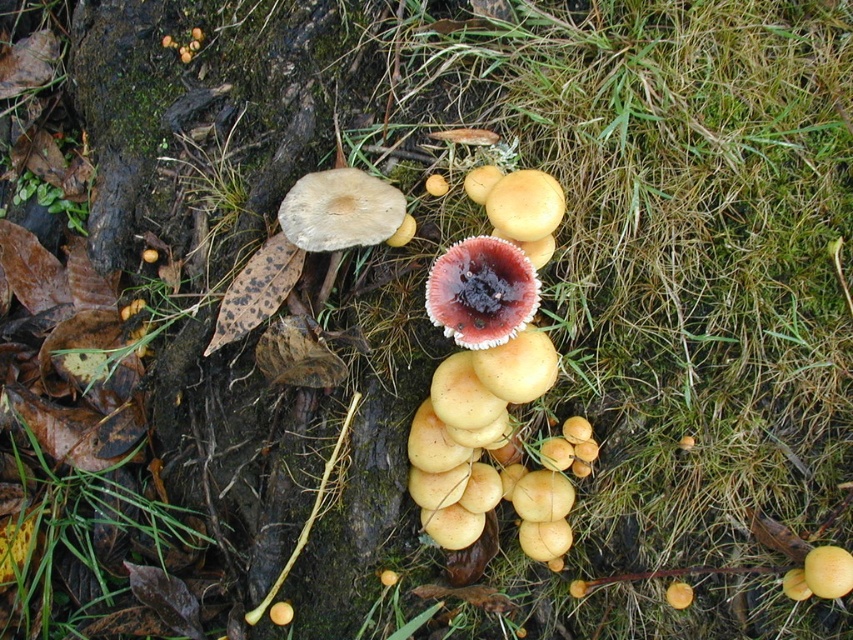
Question: Does yellowish-brown mushroom at center have a greater width compared to dark red velvety mushroom at center?

Choices:
 (A) no
 (B) yes

Answer: (B)

Question: Where is yellowish-brown mushroom at center located in relation to light brown matte mushroom at upper center in the image?

Choices:
 (A) above
 (B) below

Answer: (B)

Question: Estimate the real-world distances between objects in this image. Which object is closer to the light brown matte mushroom at upper center?

Choices:
 (A) dark red velvety mushroom at center
 (B) yellowish-brown mushroom at center

Answer: (A)

Question: Estimate the real-world distances between objects in this image. Which object is closer to the yellowish-brown mushroom at center?

Choices:
 (A) dark red velvety mushroom at center
 (B) light brown matte mushroom at upper center

Answer: (A)

Question: Does dark red velvety mushroom at center appear on the right side of light brown matte mushroom at upper center?

Choices:
 (A) yes
 (B) no

Answer: (A)

Question: Which point is closer to the camera?

Choices:
 (A) light brown matte mushroom at upper center
 (B) yellowish-brown mushroom at center
 (C) dark red velvety mushroom at center

Answer: (C)